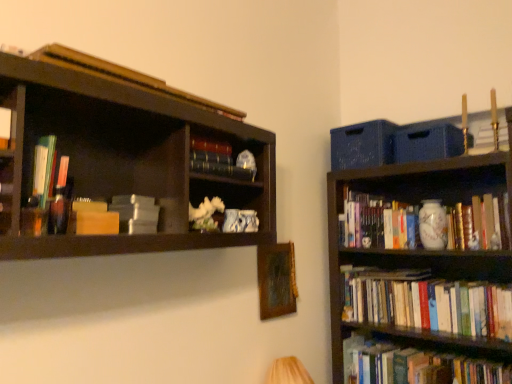
Question: Is matte plastic books at left, marked as the fourth book in a bottom-to-top arrangement, thinner than wooden picture frame at center?

Choices:
 (A) yes
 (B) no

Answer: (B)

Question: Considering the relative sizes of matte plastic books at left, which is the second book from left to right, and wooden picture frame at center in the image provided, is matte plastic books at left, which is the second book from left to right, wider than wooden picture frame at center?

Choices:
 (A) yes
 (B) no

Answer: (A)

Question: Can you confirm if matte plastic books at left, the fifth book positioned from the back, is shorter than wooden picture frame at center?

Choices:
 (A) no
 (B) yes

Answer: (B)

Question: Are matte plastic books at left, the fourth book positioned from the top, and wooden picture frame at center located far from each other?

Choices:
 (A) no
 (B) yes

Answer: (B)

Question: Is matte plastic books at left, the fifth book positioned from the back, oriented towards wooden picture frame at center?

Choices:
 (A) no
 (B) yes

Answer: (A)

Question: Is point (37, 203) closer or farther from the camera than point (123, 218)?

Choices:
 (A) farther
 (B) closer

Answer: (B)

Question: Looking at their shapes, would you say matte plastic books at left, placed as the 3th book when sorted from front to back, is wider or thinner than matte gray book at upper left, which ranks as the fifth book in top-to-bottom order?

Choices:
 (A) wide
 (B) thin

Answer: (B)

Question: From a real-world perspective, is matte plastic books at left, which is the second book from left to right, above or below matte gray book at upper left, positioned as the fifth book in right-to-left order?

Choices:
 (A) above
 (B) below

Answer: (A)

Question: Considering the relative positions of matte plastic books at left, which is the sixth book from right to left, and matte gray book at upper left, positioned as the third book in left-to-right order, in the image provided, is matte plastic books at left, which is the sixth book from right to left, to the left or to the right of matte gray book at upper left, positioned as the third book in left-to-right order,?

Choices:
 (A) right
 (B) left

Answer: (B)

Question: From the image's perspective, is hardcover books at center-right, the second book in the right-to-left sequence, positioned above or below wooden book at upper left, positioned as the 4th book in left-to-right order?

Choices:
 (A) above
 (B) below

Answer: (B)

Question: Considering the positions of hardcover books at center-right, marked as the seventh book in a front-to-back arrangement, and wooden book at upper left, acting as the 2th book starting from the front, in the image, is hardcover books at center-right, marked as the seventh book in a front-to-back arrangement, wider or thinner than wooden book at upper left, acting as the 2th book starting from the front,?

Choices:
 (A) thin
 (B) wide

Answer: (B)

Question: Would you say hardcover books at center-right, marked as the seventh book in a front-to-back arrangement, is inside or outside wooden book at upper left, positioned as the 4th book in left-to-right order?

Choices:
 (A) outside
 (B) inside

Answer: (A)

Question: In the image, is hardcover books at center-right, the sixth book when ordered from top to bottom, positioned in front of or behind wooden book at upper left, positioned as the 7th book in bottom-to-top order?

Choices:
 (A) front
 (B) behind

Answer: (B)

Question: From a real-world perspective, relative to matte gray book at upper left, which appears as the third book when ordered from the bottom, is white paperbacks at lower right, the second book viewed from the back, vertically above or below?

Choices:
 (A) below
 (B) above

Answer: (A)

Question: In terms of height, does white paperbacks at lower right, which is the seventh book from left to right, look taller or shorter compared to matte gray book at upper left, acting as the fourth book starting from the back?

Choices:
 (A) tall
 (B) short

Answer: (A)